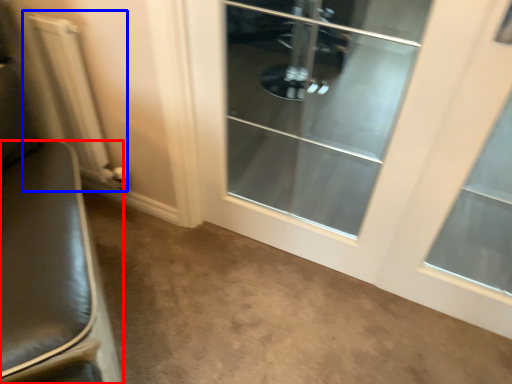
Question: Which point is closer to the camera, furniture (highlighted by a red box) or radiator (highlighted by a blue box)?

Choices:
 (A) furniture
 (B) radiator

Answer: (A)